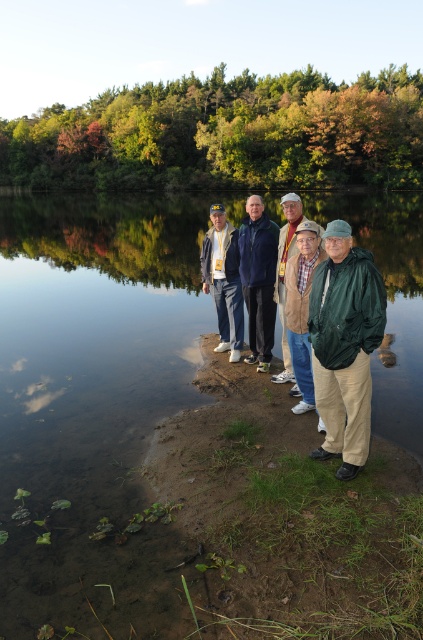
Question: Where is blue fleece jacket at center located in relation to brown leather jacket at center in the image?

Choices:
 (A) above
 (B) below

Answer: (B)

Question: Does matte blue jacket at center appear over brown leather jacket at center?

Choices:
 (A) yes
 (B) no

Answer: (B)

Question: Can you confirm if matte blue jacket at center is wider than brown leather jacket at center?

Choices:
 (A) yes
 (B) no

Answer: (A)

Question: Which point is closer to the camera?

Choices:
 (A) clear water at shore center
 (B) brown leather jacket at center
 (C) matte blue jacket at center

Answer: (A)

Question: Which of the following is the farthest from the observer?

Choices:
 (A) (264, 337)
 (B) (362, 360)
 (C) (302, 220)
 (D) (216, 296)

Answer: (D)

Question: Which point is closer to the camera taking this photo?

Choices:
 (A) (104, 598)
 (B) (285, 378)
 (C) (376, 284)

Answer: (A)